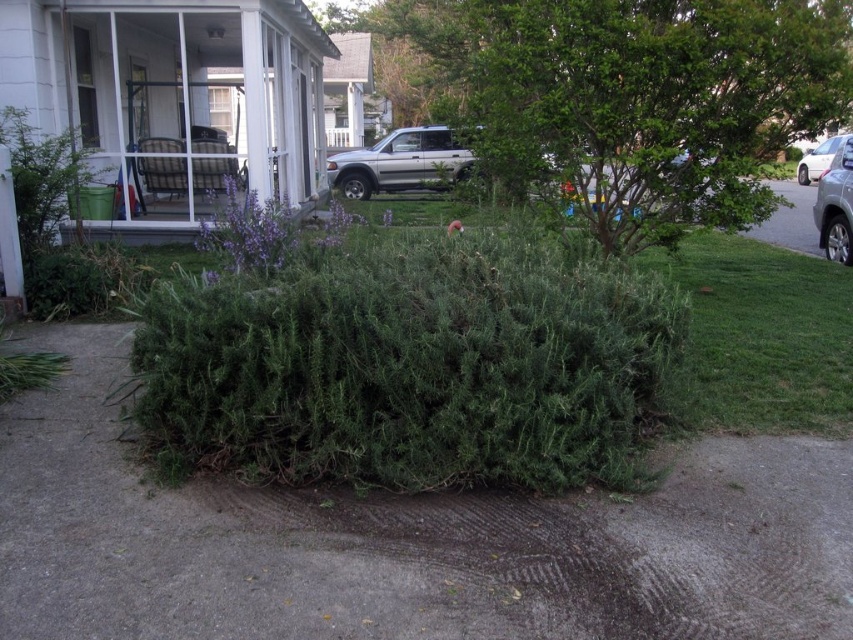
You are planning to plant a new tree in your backyard. You have a space that can accommodate a tree larger than the silver metallic car at right. Do you think the green leafy tree at center would fit in that space?

The green leafy tree at center has a larger size compared to the silver metallic car at right, so it would fit in the space that can accommodate a tree larger than the silver metallic car at right.

You are a gardener who needs to water the green leafy tree at center and the silver metallic car at right. Your watering hose is 10 meters long. Can you reach both objects with the hose without moving the hose nozzle?

The green leafy tree at center and the silver metallic car at right are 9.32 meters apart. Since the hose is 10 meters long, which is longer than the distance between them, you can reach both objects without moving the hose nozzle.